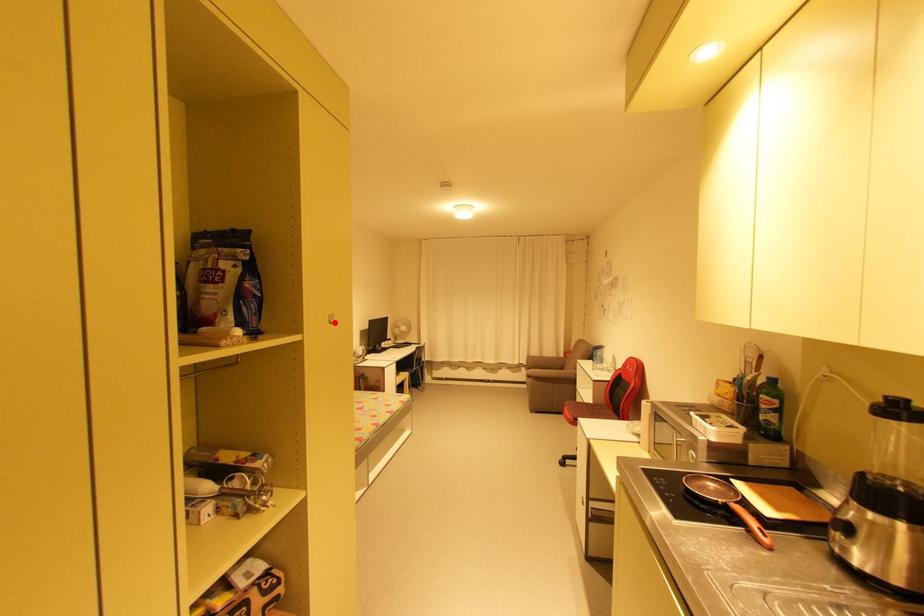
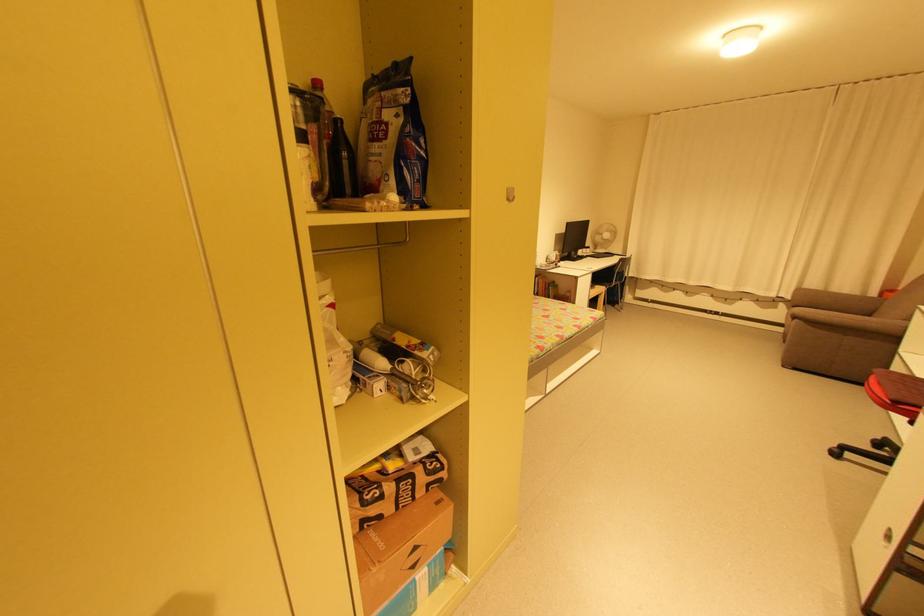
Question: I am providing you with two images of the same scene from different viewpoints. Image1 has a red point marked. In image2, the corresponding 3D location appears at what relative position? Reply with the corresponding letter.

Choices:
 (A) Closer
 (B) Farther

Answer: (B)